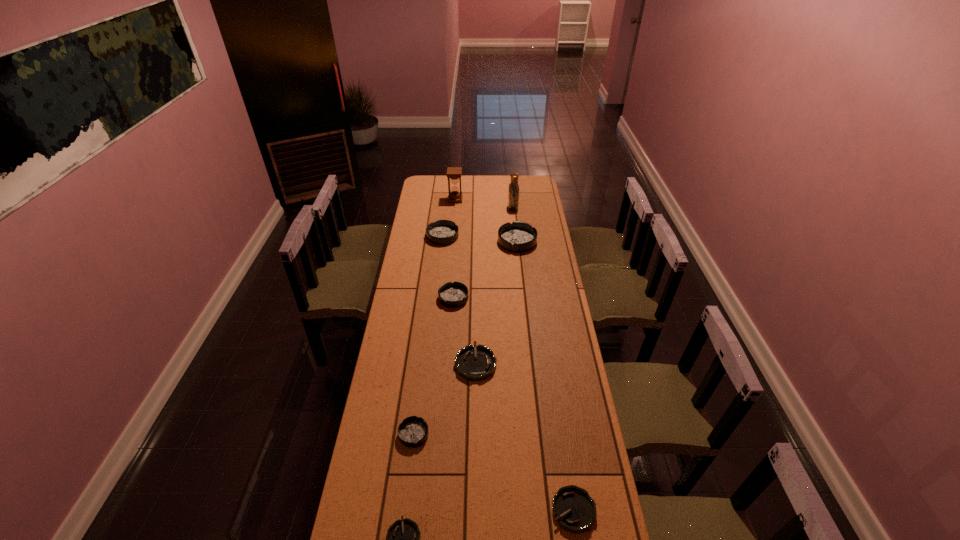
Where is `the second farthest object`? the second farthest object is located at coordinates (513, 189).

Find the location of a particular element. This screenshot has height=540, width=960. hourglass is located at coordinates (453, 173).

I want to click on the tallest ashtray, so click(518, 237).

Where is `the rightmost dark ashtray`? the rightmost dark ashtray is located at coordinates (518, 237).

Find the location of a particular element. The height and width of the screenshot is (540, 960). the second tallest ashtray is located at coordinates (441, 232).

Identify the location of the sixth shortest object. (441, 232).

Find the location of a particular element. This screenshot has height=540, width=960. the fifth shortest ashtray is located at coordinates (452, 295).

Find the location of a particular element. the third farthest dark ashtray is located at coordinates (452, 295).

You are a GUI agent. You are given a task and a screenshot of the screen. Output one action in this format:
    pyautogui.click(x=<x>, y=<y>)
    Task: Click on the fourth nearest ashtray
    This screenshot has height=540, width=960.
    Given the screenshot: What is the action you would take?
    pyautogui.click(x=474, y=363)

The height and width of the screenshot is (540, 960). In order to click on the fourth nearest object in this screenshot , I will do [x=474, y=363].